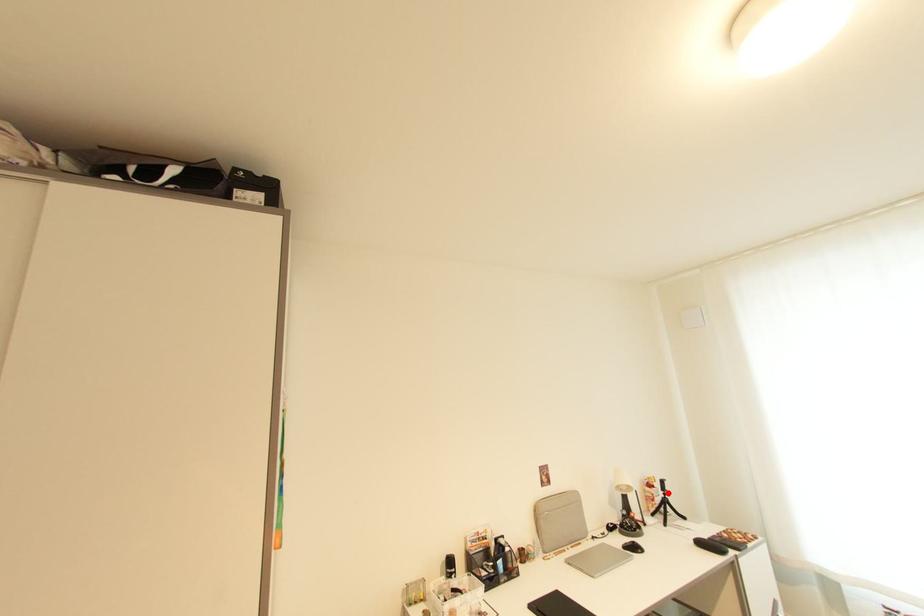
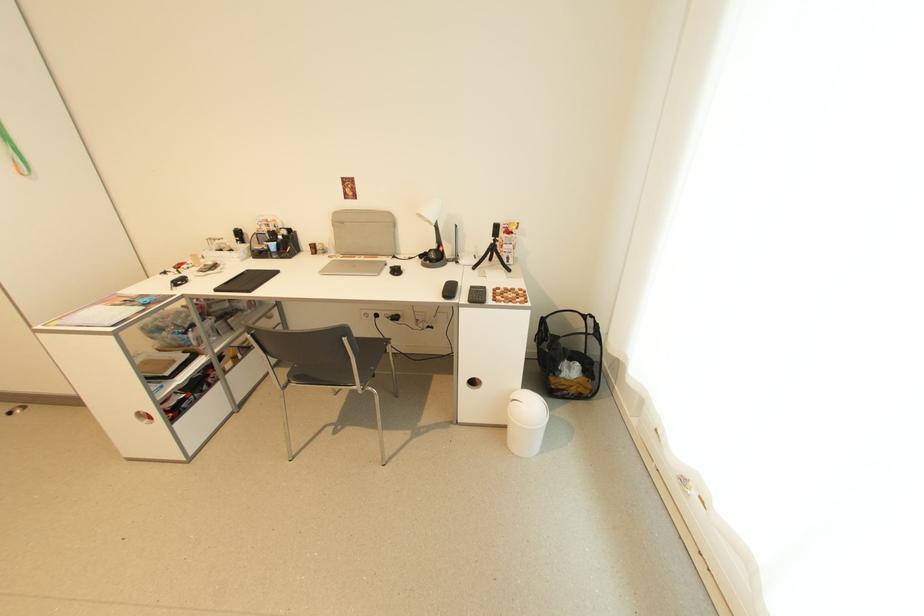
Question: I am providing you with two images of the same scene from different viewpoints. In image1, a red point is highlighted. Considering the same 3D point in image2, which of the following is correct?

Choices:
 (A) It is closer
 (B) It is farther

Answer: (A)